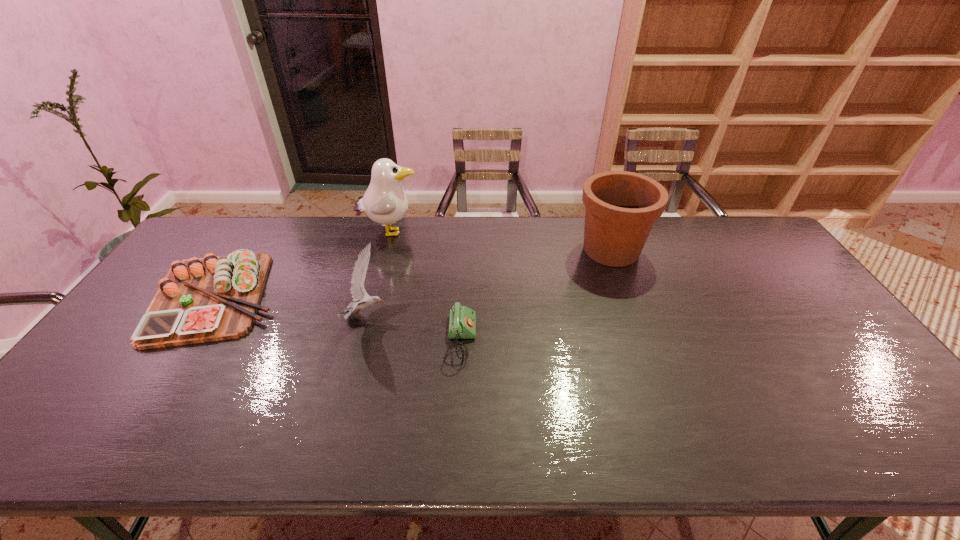
In order to click on vacant space located on the beak of the taller gull in this screenshot , I will do `click(445, 232)`.

At what (x,y) coordinates should I click in order to perform the action: click on free space located on the back of the flowerpot. Please return your answer as a coordinate pair (x, y). Image resolution: width=960 pixels, height=540 pixels. Looking at the image, I should click on 599,217.

This screenshot has width=960, height=540. Find the location of `vacant space located at the tip of the beak of the third shortest object`. vacant space located at the tip of the beak of the third shortest object is located at coordinates (436, 316).

You are a GUI agent. You are given a task and a screenshot of the screen. Output one action in this format:
    pyautogui.click(x=<x>, y=<y>)
    Task: Click on the vacant space located on the right of the leftmost object
    The width and height of the screenshot is (960, 540).
    Given the screenshot: What is the action you would take?
    pyautogui.click(x=310, y=297)

This screenshot has width=960, height=540. I want to click on vacant space located on the dial of the fourth object from left to right, so click(x=572, y=341).

At what (x,y) coordinates should I click in order to perform the action: click on gull present at the far edge. Please return your answer as a coordinate pair (x, y). The width and height of the screenshot is (960, 540). Looking at the image, I should click on (385, 202).

Identify the location of flowerpot that is positioned at the far edge. (621, 207).

The image size is (960, 540). What are the coordinates of `platter that is at the far edge` in the screenshot? It's located at (207, 299).

You are a GUI agent. You are given a task and a screenshot of the screen. Output one action in this format:
    pyautogui.click(x=<x>, y=<y>)
    Task: Click on the object that is at the left edge
    
    Given the screenshot: What is the action you would take?
    pyautogui.click(x=207, y=299)

Identify the location of object present at the far left corner. This screenshot has width=960, height=540. (207, 299).